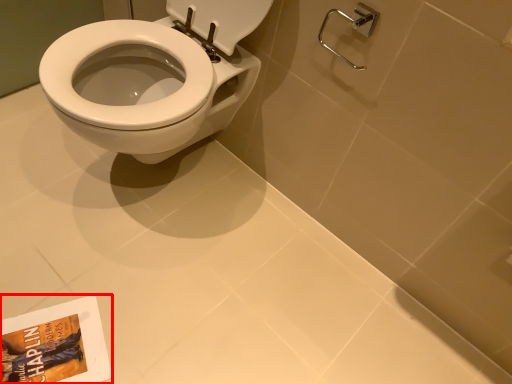
Question: From the image's perspective, where is paperback book (annotated by the red box) located in relation to shower in the image?

Choices:
 (A) below
 (B) above

Answer: (A)